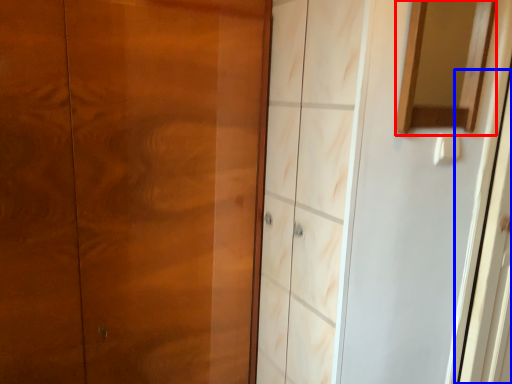
Question: Which object is closer to the camera taking this photo, mirror (highlighted by a red box) or screen door (highlighted by a blue box)?

Choices:
 (A) mirror
 (B) screen door

Answer: (A)